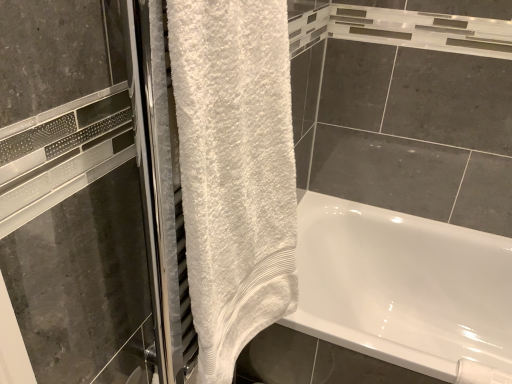
Question: From a real-world perspective, is white fluffy towel at left over white glossy bathtub at lower right?

Choices:
 (A) no
 (B) yes

Answer: (B)

Question: Can you confirm if white fluffy towel at left is bigger than white glossy bathtub at lower right?

Choices:
 (A) no
 (B) yes

Answer: (A)

Question: From the image's perspective, is white fluffy towel at left below white glossy bathtub at lower right?

Choices:
 (A) no
 (B) yes

Answer: (A)

Question: Is white glossy bathtub at lower right completely or partially inside white fluffy towel at left?

Choices:
 (A) yes
 (B) no

Answer: (B)

Question: Is white fluffy towel at left not inside white glossy bathtub at lower right?

Choices:
 (A) no
 (B) yes

Answer: (B)

Question: Is there a large distance between white fluffy towel at left and white glossy bathtub at lower right?

Choices:
 (A) yes
 (B) no

Answer: (B)

Question: Is white fluffy towel at left completely or partially inside white glossy bathtub at lower right?

Choices:
 (A) yes
 (B) no

Answer: (B)

Question: Is white glossy bathtub at lower right closer to the viewer compared to white fluffy towel at left?

Choices:
 (A) no
 (B) yes

Answer: (A)

Question: From a real-world perspective, is white glossy bathtub at lower right on top of white fluffy towel at left?

Choices:
 (A) no
 (B) yes

Answer: (A)

Question: Can you confirm if white glossy bathtub at lower right is thinner than white fluffy towel at left?

Choices:
 (A) no
 (B) yes

Answer: (A)

Question: Is white glossy bathtub at lower right placed right next to white fluffy towel at left?

Choices:
 (A) yes
 (B) no

Answer: (B)

Question: Is white glossy bathtub at lower right bigger than white fluffy towel at left?

Choices:
 (A) no
 (B) yes

Answer: (B)

Question: From the image's perspective, is white glossy bathtub at lower right above or below white fluffy towel at left?

Choices:
 (A) below
 (B) above

Answer: (A)